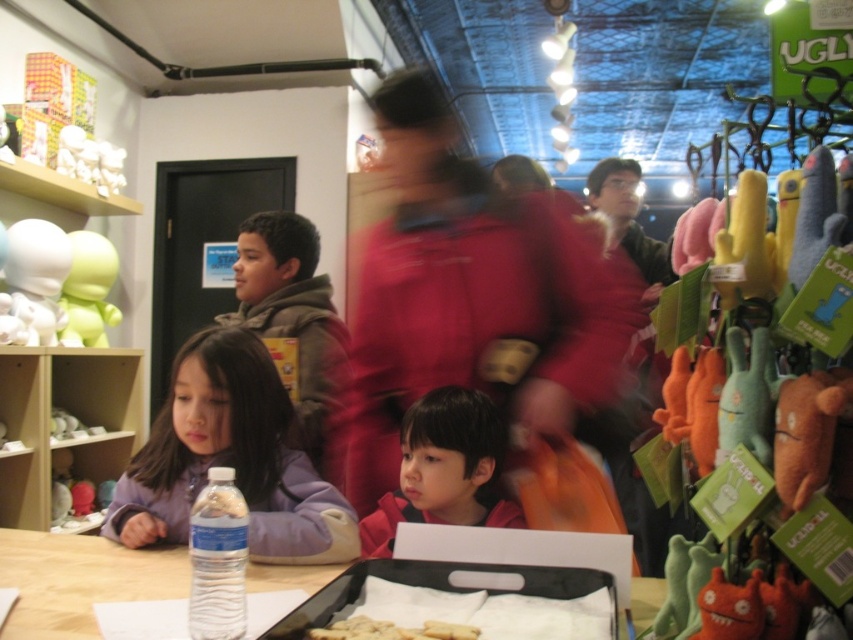
Can you confirm if brown plush toy at right is thinner than white crumbly bread at center?

Indeed, brown plush toy at right has a lesser width compared to white crumbly bread at center.

This screenshot has width=853, height=640. I want to click on brown plush toy at right, so click(x=807, y=433).

Who is taller, matte green plush toy at left or white crumbly bread at center?

Standing taller between the two is matte green plush toy at left.

The image size is (853, 640). What are the coordinates of `matte green plush toy at left` in the screenshot? It's located at (90, 291).

The image size is (853, 640). I want to click on purple fleece jacket at center, so click(x=230, y=458).

Between purple fleece jacket at center and black plastic tray at lower center, which one is positioned lower?

black plastic tray at lower center is lower down.

Describe the element at coordinates (230, 458) in the screenshot. I see `purple fleece jacket at center` at that location.

Locate an element on the screen. The height and width of the screenshot is (640, 853). purple fleece jacket at center is located at coordinates (230, 458).